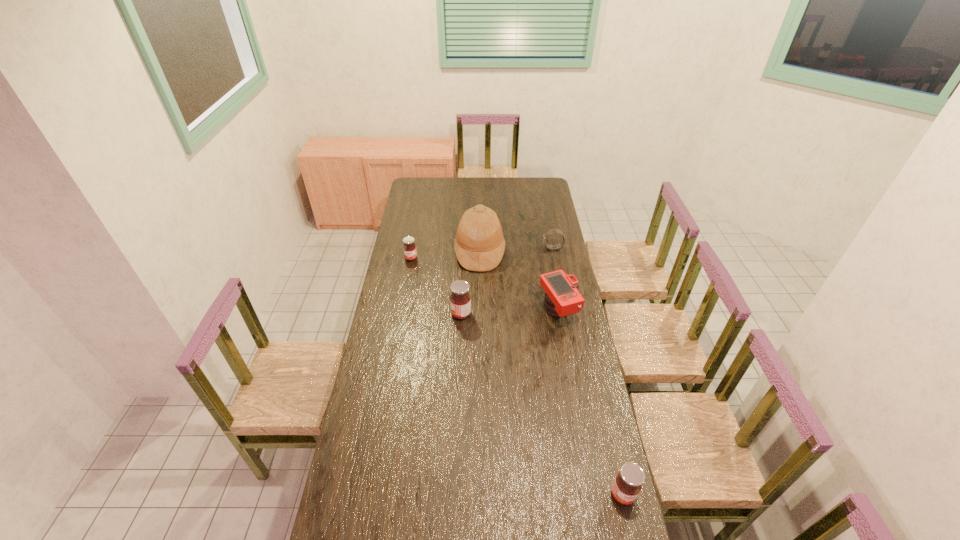
You are a GUI agent. You are given a task and a screenshot of the screen. Output one action in this format:
    pyautogui.click(x=<x>, y=<y>)
    Task: Click on the vacant area situated 0.300m on the label side of the second jam from left to right
    The image size is (960, 540).
    Given the screenshot: What is the action you would take?
    pyautogui.click(x=386, y=314)

Locate an element on the screen. vacant region located 0.220m on the label side of the second jam from left to right is located at coordinates (403, 314).

Find the location of `free location located 0.060m on the label side of the second tallest jam`. free location located 0.060m on the label side of the second tallest jam is located at coordinates (631, 528).

Where is `free region located on the front-facing side of the hat`? free region located on the front-facing side of the hat is located at coordinates (525, 252).

Locate an element on the screen. The width and height of the screenshot is (960, 540). free space located on the face of the watch is located at coordinates (490, 248).

Locate an element on the screen. free location located 0.140m on the face of the watch is located at coordinates [x=516, y=248].

Identify the location of vacant space situated on the face of the watch. (504, 248).

In order to click on free region located 0.140m on the left of the camera in this screenshot , I will do `click(509, 312)`.

The height and width of the screenshot is (540, 960). I want to click on object present at the near edge, so click(627, 484).

This screenshot has height=540, width=960. Find the location of `object that is at the left edge`. object that is at the left edge is located at coordinates (410, 252).